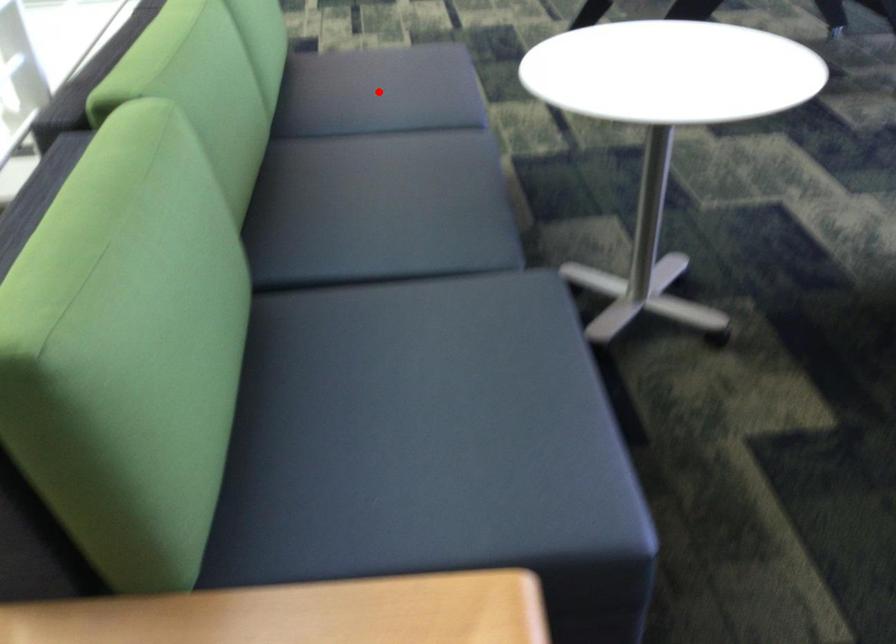
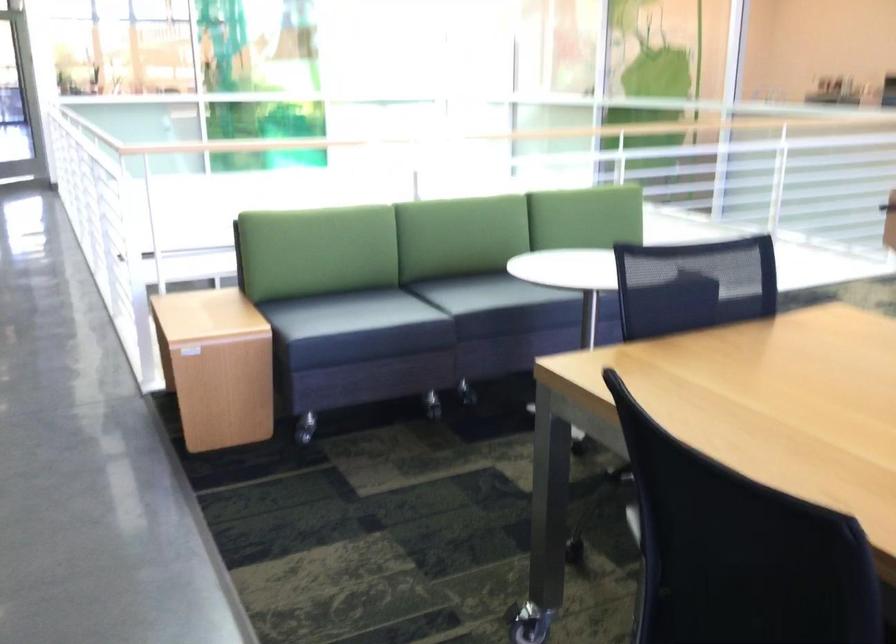
Question: I am providing you with two images of the same scene from different viewpoints. A red point is marked on the first image. Is the red point's position out of view in image 2?

Choices:
 (A) Yes
 (B) No

Answer: (A)